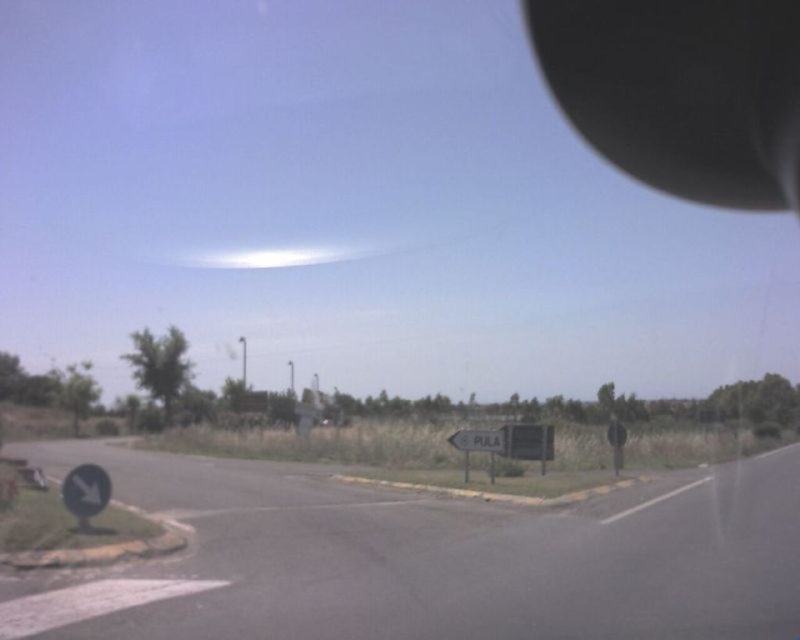
Is black matte rearview mirror at upper right to the left of white plastic sign at center from the viewer's perspective?

In fact, black matte rearview mirror at upper right is to the right of white plastic sign at center.

Is black matte rearview mirror at upper right thinner than white plastic sign at center?

Incorrect, black matte rearview mirror at upper right's width is not less than white plastic sign at center's.

Is point (745, 97) less distant than point (492, 436)?

No, (745, 97) is further to viewer.

Find the location of a particular element. Image resolution: width=800 pixels, height=640 pixels. black matte rearview mirror at upper right is located at coordinates (682, 92).